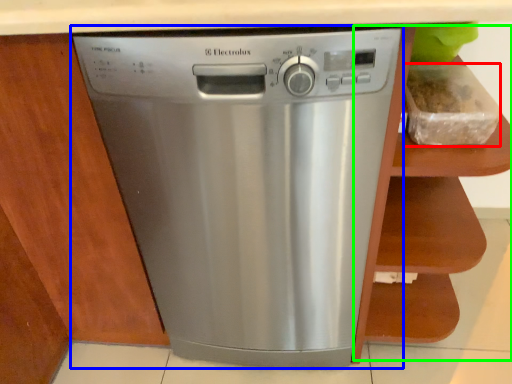
Question: Considering the real-world distances, which object is closest to food (highlighted by a red box)? home appliance (highlighted by a blue box) or cabinet (highlighted by a green box).

Choices:
 (A) home appliance
 (B) cabinet

Answer: (B)